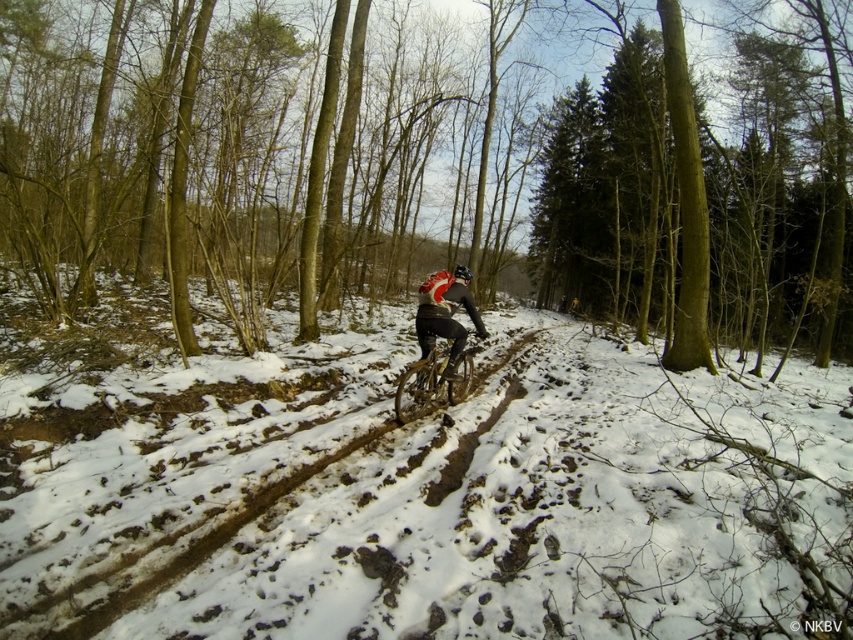
You are a cyclist planning to ride through the snowy trail shown in the image. You notice the white powdery snow at center and the shiny black bike at center. Which area should you avoid to prevent getting stuck in deep snow?

You should avoid the white powdery snow at center because it might be wider than the shiny black bike at center, indicating it could be deeper or more unstable, making it harder to navigate.

You are a cyclist planning to take a photo of the brown wood tree at center and the matte black cycling suit at center from a position ahead of the trail. Which object should you focus on first to ensure both are in the frame?

You should focus on the brown wood tree at center first because it is positioned to the right of the matte black cycling suit at center, so adjusting the frame to include the tree on the right ensures both objects are captured.

You are a hiker planning to walk across the white powdery snow at center and the shiny black bike at center. Which object will you encounter first if you start walking from the left side of the trail?

The shiny black bike at center will be encountered first because it is smaller in size than the white powdery snow at center, so it is positioned closer to the starting point.